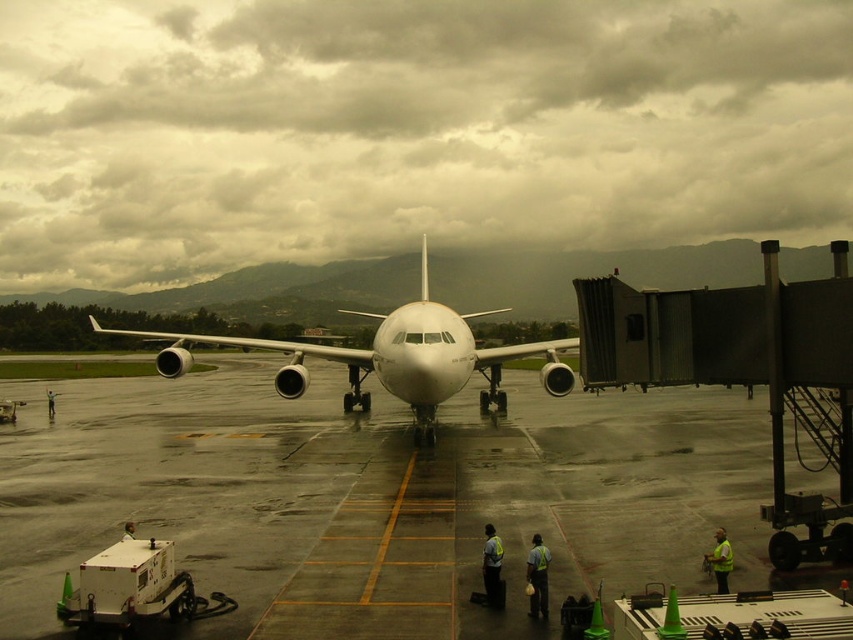
Is point (486, 602) positioned behind point (50, 403)?

No, (486, 602) is in front of (50, 403).

Is point (492, 596) closer to camera compared to point (54, 410)?

Yes, it is in front of point (54, 410).

Locate an element on the screen. reflective yellow vest at center is located at coordinates (492, 566).

Between smooth concrete tarmac at center and yellow reflective vest at lower right, which one has more height?

yellow reflective vest at lower right is taller.

This screenshot has width=853, height=640. What do you see at coordinates (373, 499) in the screenshot?
I see `smooth concrete tarmac at center` at bounding box center [373, 499].

The image size is (853, 640). I want to click on smooth concrete tarmac at center, so click(373, 499).

Where is `smooth concrete tarmac at center`? This screenshot has width=853, height=640. smooth concrete tarmac at center is located at coordinates (373, 499).

Does smooth concrete tarmac at center have a smaller size compared to light brown leather jacket at lower left?

No, smooth concrete tarmac at center is not smaller than light brown leather jacket at lower left.

Locate an element on the screen. smooth concrete tarmac at center is located at coordinates (373, 499).

Where is `smooth concrete tarmac at center`? The width and height of the screenshot is (853, 640). smooth concrete tarmac at center is located at coordinates (373, 499).